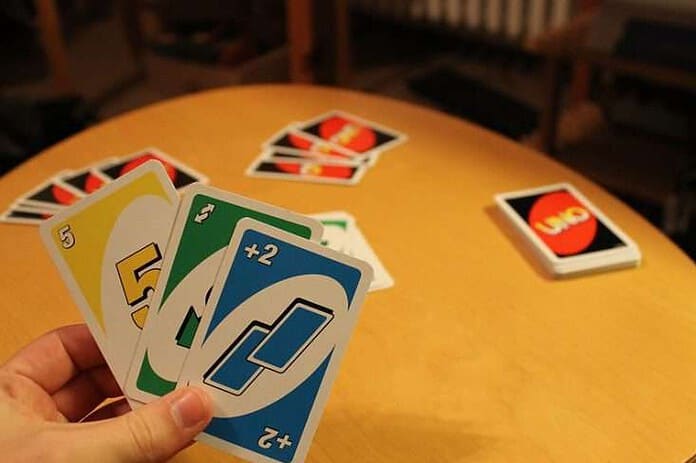
You are a GUI agent. You are given a task and a screenshot of the screen. Output one action in this format:
    pyautogui.click(x=<x>, y=<y>)
    Task: Click on the wall
    Image resolution: width=696 pixels, height=463 pixels.
    Given the screenshot: What is the action you would take?
    pyautogui.click(x=109, y=55)